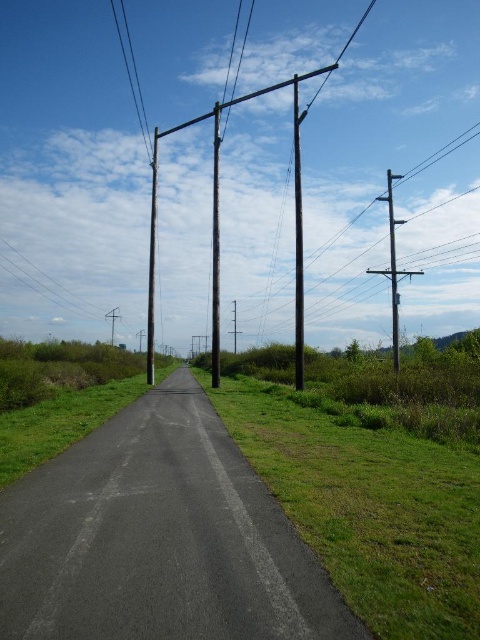
Does black asphalt road at center appear on the right side of smooth wood telegraph pole at center?

Yes, black asphalt road at center is to the right of smooth wood telegraph pole at center.

Which is behind, point (80, 614) or point (215, 326)?

Positioned behind is point (215, 326).

At what (x,y) coordinates should I click in order to perform the action: click on black asphalt road at center. Please return your answer as a coordinate pair (x, y). Looking at the image, I should click on (158, 538).

Locate an element on the screen. black asphalt road at center is located at coordinates (158, 538).

Is black asphalt road at center bigger than green grassy at center?

Incorrect, black asphalt road at center is not larger than green grassy at center.

Which of these two, black asphalt road at center or green grassy at center, stands shorter?

With less height is black asphalt road at center.

Is point (178, 538) positioned in front of point (412, 609)?

No, (178, 538) is further to viewer.

At what (x,y) coordinates should I click in order to perform the action: click on black asphalt road at center. Please return your answer as a coordinate pair (x, y). Looking at the image, I should click on (158, 538).

Can you confirm if black asphalt road at center is positioned above smooth wire at upper left?

Incorrect, black asphalt road at center is not positioned above smooth wire at upper left.

What are the coordinates of `black asphalt road at center` in the screenshot? It's located at (158, 538).

At what (x,y) coordinates should I click in order to perform the action: click on black asphalt road at center. Please return your answer as a coordinate pair (x, y). Image resolution: width=480 pixels, height=640 pixels. Looking at the image, I should click on (158, 538).